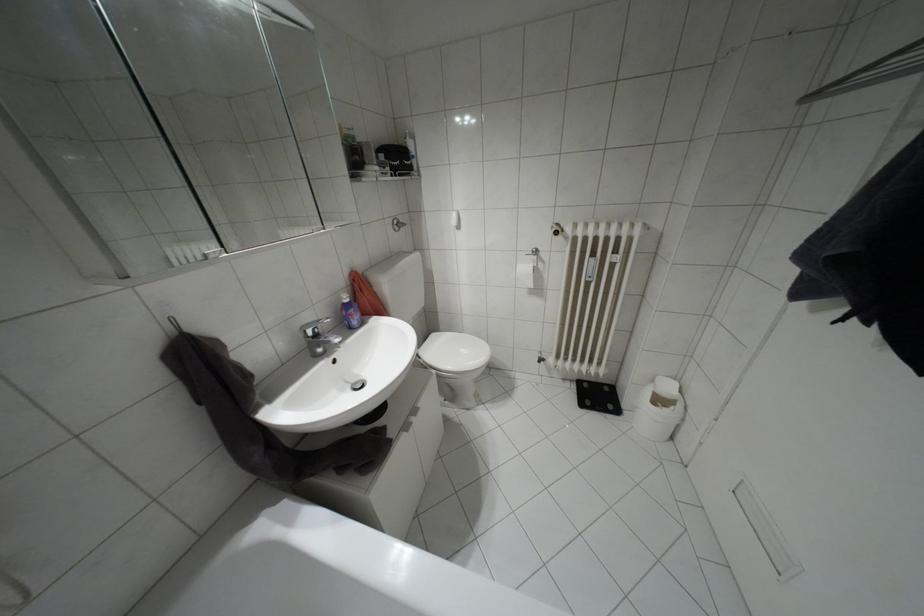
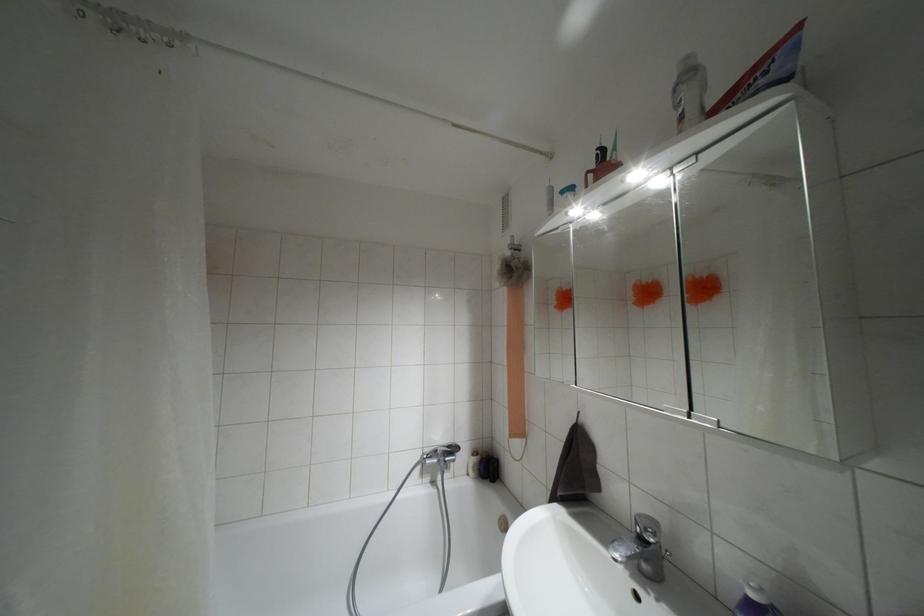
In the second image, find the point that corresponds to (346,300) in the first image.

(751, 594)